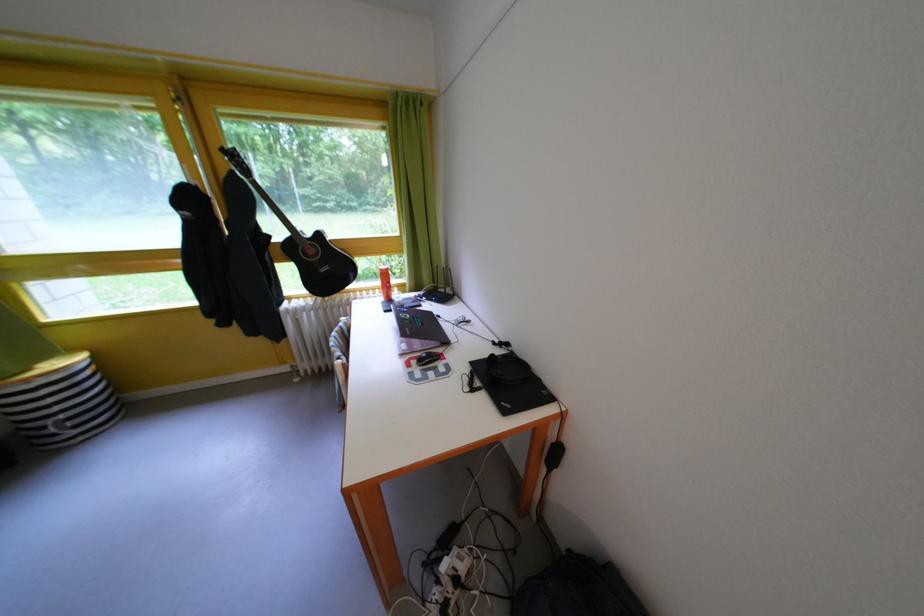
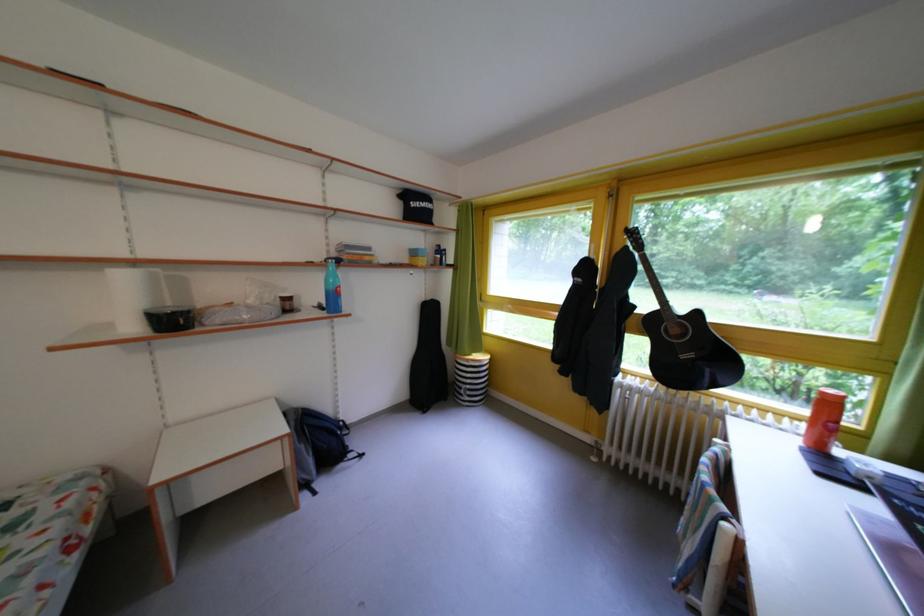
The point at [71,423] is marked in the first image. Where is the corresponding point in the second image?

(478, 392)